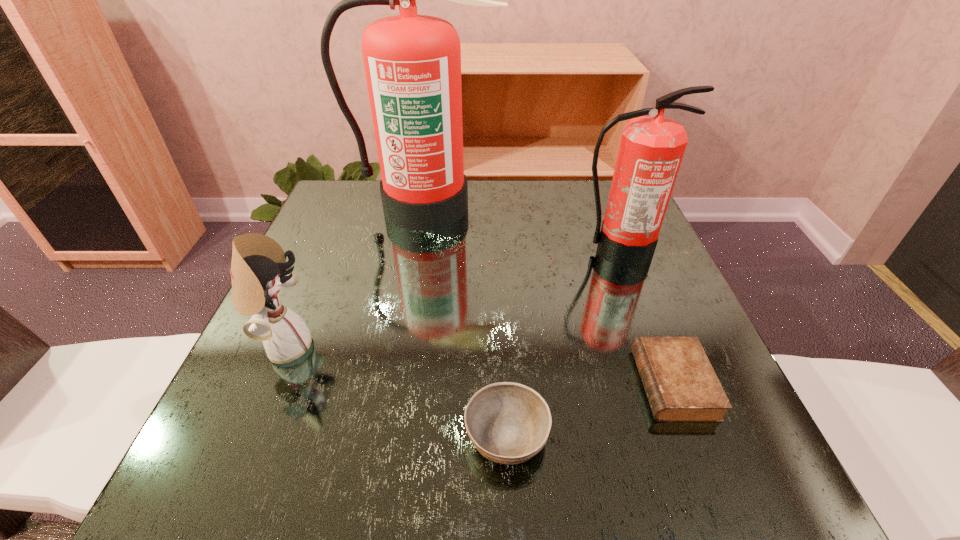
The image size is (960, 540). Identify the location of the tallest object. (412, 62).

At what (x,y) coordinates should I click in order to perform the action: click on the farthest object. Please return your answer as a coordinate pair (x, y). Looking at the image, I should click on (412, 62).

Locate an element on the screen. the right fire extinguisher is located at coordinates (651, 150).

The width and height of the screenshot is (960, 540). In order to click on the fourth nearest object in this screenshot , I will do `click(651, 150)`.

Find the location of a particular element. The image size is (960, 540). the third shortest object is located at coordinates (258, 269).

Locate an element on the screen. This screenshot has width=960, height=540. bowl is located at coordinates (508, 423).

You are a GUI agent. You are given a task and a screenshot of the screen. Output one action in this format:
    pyautogui.click(x=<x>, y=<y>)
    Task: Click on the diary
    This screenshot has width=960, height=540.
    Given the screenshot: What is the action you would take?
    pyautogui.click(x=681, y=385)

The height and width of the screenshot is (540, 960). I want to click on free space located 0.130m at the nozzle of the farthest object, so click(417, 264).

Locate an element on the screen. The width and height of the screenshot is (960, 540). vacant space located on the front side of the right fire extinguisher is located at coordinates (643, 313).

This screenshot has height=540, width=960. I want to click on vacant area located 0.340m at the front face of the doll, so click(501, 347).